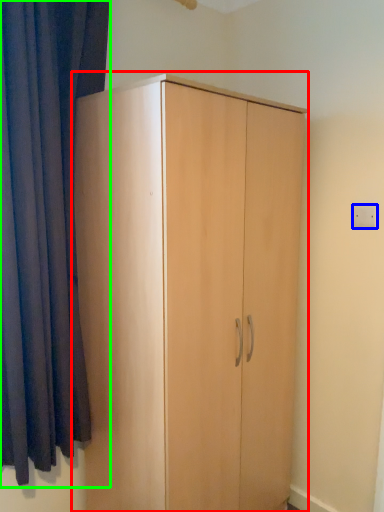
Question: Which is farther away from cupboard (highlighted by a red box)? electric outlet (highlighted by a blue box) or curtain (highlighted by a green box)?

Choices:
 (A) electric outlet
 (B) curtain

Answer: (A)